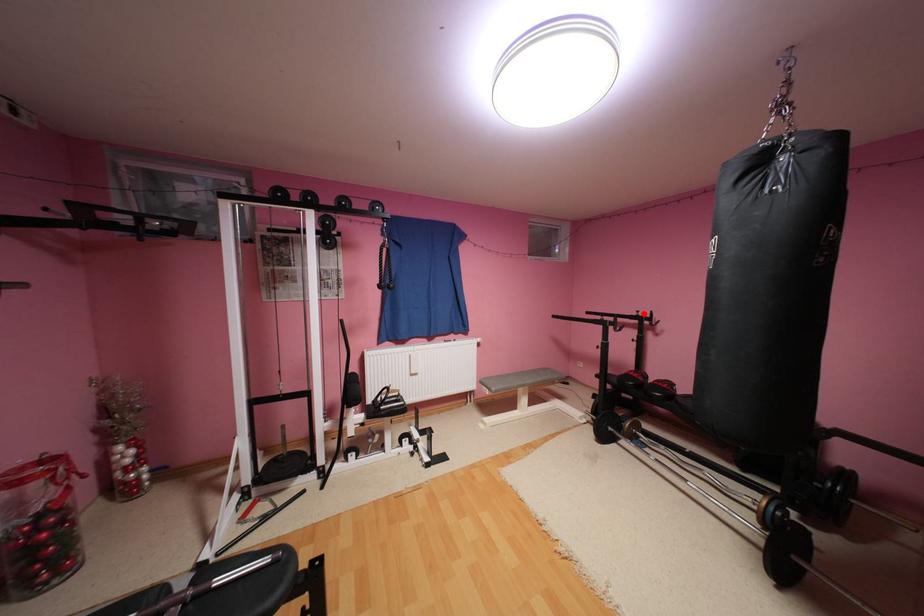
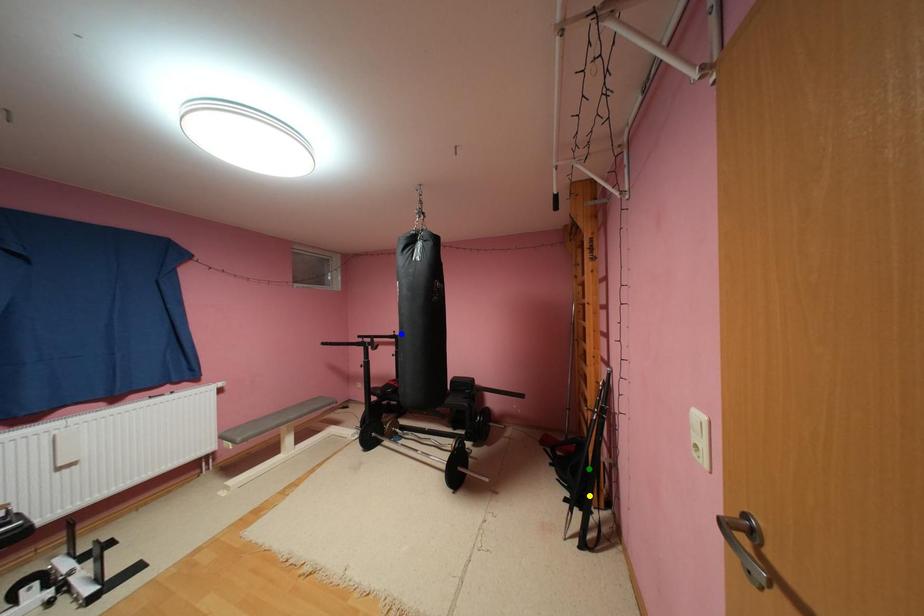
Question: I am providing you with two images of the same scene from different viewpoints. A red point is marked on the first image. You are given multiple points on the second image. Which point in image 2 represents the same 3d spot as the red point in image 1?

Choices:
 (A) yellow point
 (B) blue point
 (C) green point

Answer: (B)